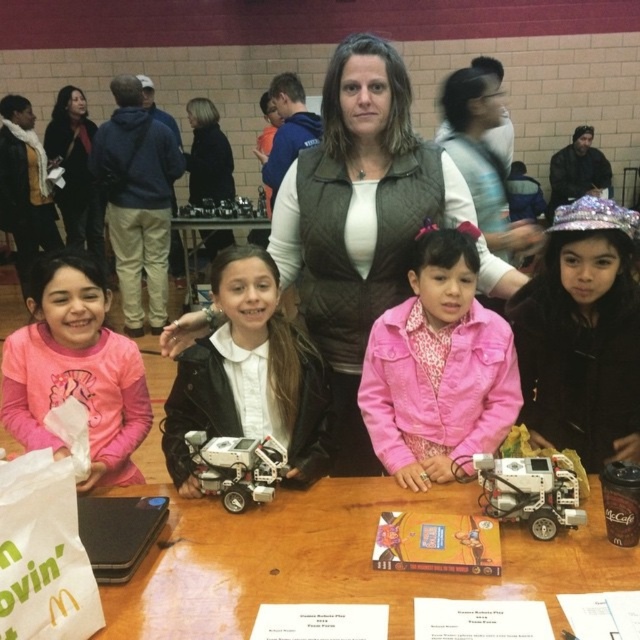
Question: Which of the following is the farthest from the observer?

Choices:
 (A) pink corduroy jacket at center
 (B) silver metallic robot at center
 (C) white matte robot at center
 (D) pink fleece jacket at lower left

Answer: (D)

Question: Does sparkly silver tiara at upper right have a larger size compared to white textured sweater at center?

Choices:
 (A) yes
 (B) no

Answer: (B)

Question: Among these objects, which one is farthest from the camera?

Choices:
 (A) pink corduroy jacket at center
 (B) wooden table at center
 (C) white textured sweater at center
 (D) white matte robot at center

Answer: (C)

Question: Is brown quilted vest at center positioned behind pink fleece jacket at lower left?

Choices:
 (A) no
 (B) yes

Answer: (B)

Question: Which of the following is the farthest from the observer?

Choices:
 (A) (394, 506)
 (B) (589, 305)
 (C) (60, 193)
 (D) (230, 496)

Answer: (C)

Question: Can you confirm if pink fleece jacket at lower left is smaller than white textured sweater at center?

Choices:
 (A) no
 (B) yes

Answer: (B)